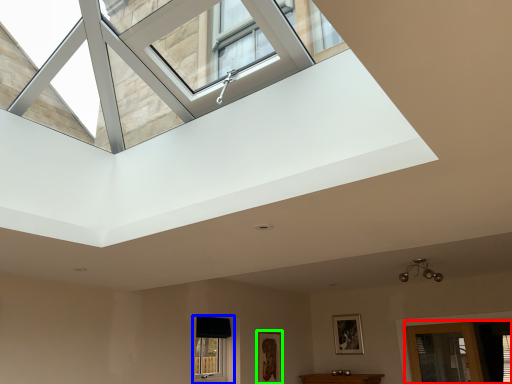
Question: Which object is the closest to the glass door (highlighted by a red box)? Choose among these: window (highlighted by a blue box) or picture frame (highlighted by a green box).

Choices:
 (A) window
 (B) picture frame

Answer: (B)